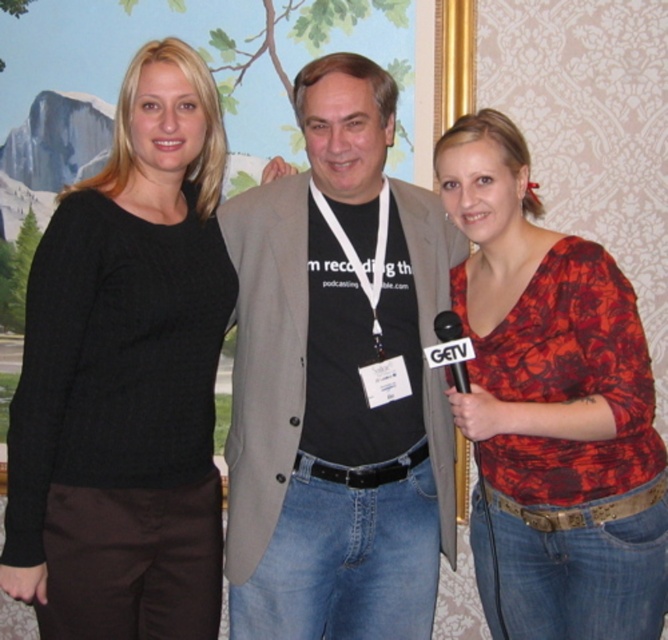
You are standing in the room where the photo was taken and want to place a small decoration between the two points labeled as point (158, 138) and point (315, 248). Which point is closer to you where you should start placing the decoration?

Point (158, 138) is closer to the viewer than point (315, 248), so you should start placing the decoration near point (158, 138) first since it is nearer to your position.